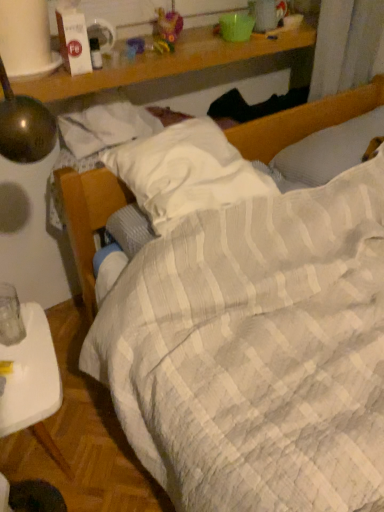
I want to click on free spot above white textured pillow at upper right, marked as the 2th pillow in a left-to-right arrangement (from a real-world perspective), so click(x=366, y=126).